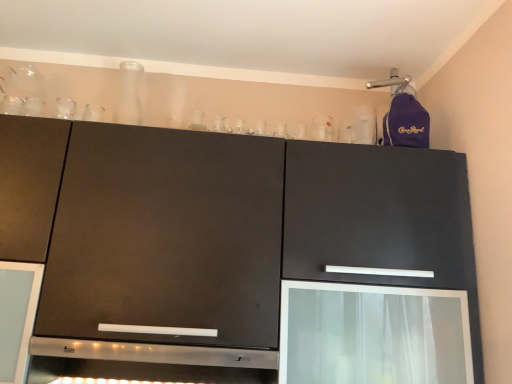
Question: Does transparent glass screen door at lower right have a lesser height compared to transparent glass carafe at upper center?

Choices:
 (A) no
 (B) yes

Answer: (B)

Question: From a real-world perspective, is transparent glass screen door at lower right located beneath transparent glass carafe at upper center?

Choices:
 (A) yes
 (B) no

Answer: (A)

Question: Does transparent glass screen door at lower right appear on the left side of transparent glass carafe at upper center?

Choices:
 (A) no
 (B) yes

Answer: (A)

Question: Is transparent glass screen door at lower right positioned far away from transparent glass carafe at upper center?

Choices:
 (A) yes
 (B) no

Answer: (A)

Question: Is transparent glass screen door at lower right in front of transparent glass carafe at upper center?

Choices:
 (A) yes
 (B) no

Answer: (A)

Question: Is transparent glass carafe at upper center taller or shorter than satin silver exhaust hood at center?

Choices:
 (A) tall
 (B) short

Answer: (A)

Question: Is transparent glass carafe at upper center in front of or behind satin silver exhaust hood at center in the image?

Choices:
 (A) behind
 (B) front

Answer: (A)

Question: Considering the relative positions of transparent glass carafe at upper center and satin silver exhaust hood at center in the image provided, is transparent glass carafe at upper center to the left or to the right of satin silver exhaust hood at center?

Choices:
 (A) right
 (B) left

Answer: (B)

Question: Is transparent glass carafe at upper center inside the boundaries of satin silver exhaust hood at center, or outside?

Choices:
 (A) inside
 (B) outside

Answer: (B)

Question: From the image's perspective, is matte black cabinet at upper center positioned above or below satin silver exhaust hood at center?

Choices:
 (A) below
 (B) above

Answer: (B)

Question: Is matte black cabinet at upper center in front of or behind satin silver exhaust hood at center in the image?

Choices:
 (A) behind
 (B) front

Answer: (B)

Question: From a real-world perspective, is matte black cabinet at upper center above or below satin silver exhaust hood at center?

Choices:
 (A) below
 (B) above

Answer: (B)

Question: Considering the positions of matte black cabinet at upper center and satin silver exhaust hood at center in the image, is matte black cabinet at upper center taller or shorter than satin silver exhaust hood at center?

Choices:
 (A) tall
 (B) short

Answer: (A)

Question: Is satin silver exhaust hood at center wider or thinner than transparent glass screen door at lower right?

Choices:
 (A) thin
 (B) wide

Answer: (B)

Question: From their relative heights in the image, would you say satin silver exhaust hood at center is taller or shorter than transparent glass screen door at lower right?

Choices:
 (A) short
 (B) tall

Answer: (A)